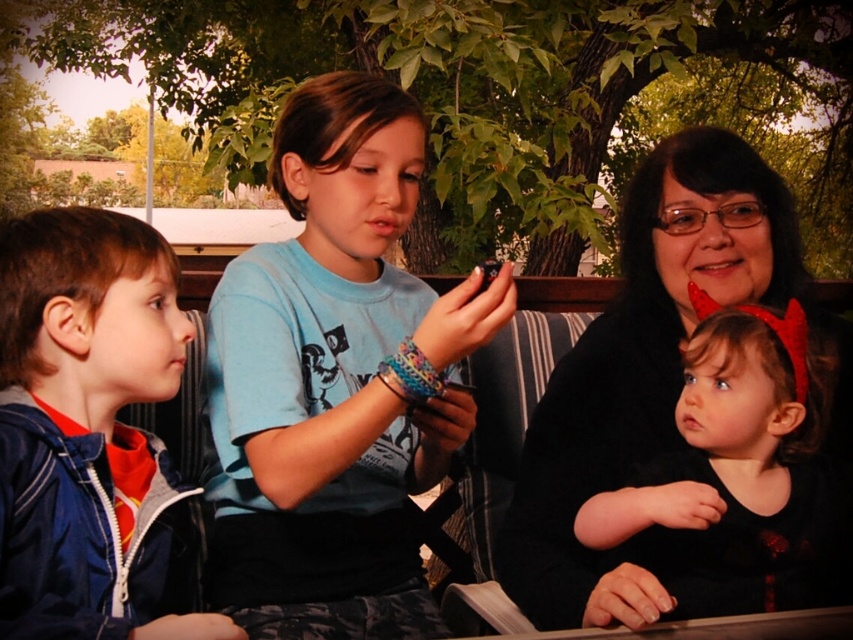
You are a photographer trying to frame a shot between the blue denim jacket at left and the black matte hair at upper right. The minimum distance your camera can focus on both subjects simultaneously is 28 inches. Will you be able to capture both in focus?

The blue denim jacket at left and black matte hair at upper right are 27.03 inches apart, which is less than the camera minimum focus distance of 28 inches. Therefore, you can capture both in focus.

In the scene shown: You are standing in front of this image and want to touch both the blue denim jacket at left and the black matte hair at upper right. Which one can you reach first without moving your hand?

The blue denim jacket at left is closer to the viewer than the black matte hair at upper right, so you can reach it first without moving your hand.